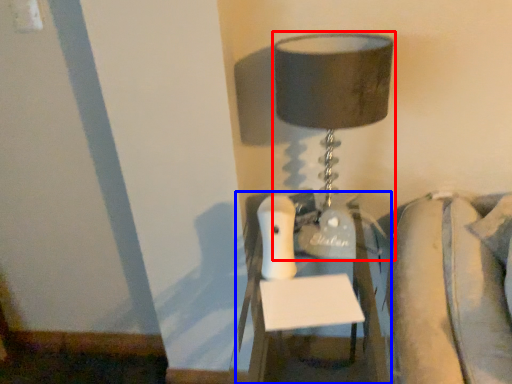
Question: Which object is closer to the camera taking this photo, lamp (highlighted by a red box) or furniture (highlighted by a blue box)?

Choices:
 (A) lamp
 (B) furniture

Answer: (B)